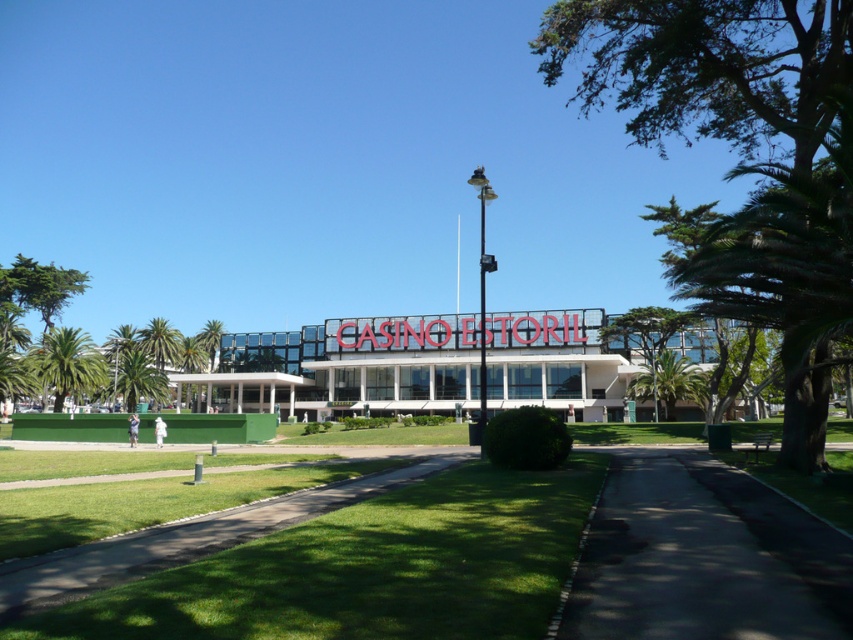
Question: Does green leafy palm tree at lower left appear on the right side of green leafy palm tree at center?

Choices:
 (A) yes
 (B) no

Answer: (A)

Question: Which object appears closest to the camera in this image?

Choices:
 (A) green leafy palm tree at center-right
 (B) green leafy palm tree at lower left
 (C) green leafy palm tree at center

Answer: (A)

Question: Which point is closer to the camera?

Choices:
 (A) green leafy palm tree at center-right
 (B) green leafy palm tree at center
 (C) green leafy palm tree at left

Answer: (A)

Question: Does green leafy palm tree at center-right appear on the right side of green leafy palm tree at center?

Choices:
 (A) yes
 (B) no

Answer: (A)

Question: Can you confirm if green leafy palm tree at left is thinner than green leafy palm tree at lower left?

Choices:
 (A) no
 (B) yes

Answer: (A)

Question: Based on their relative distances, which object is farther from the green leafy palm tree at center-right?

Choices:
 (A) green leafy palm tree at center
 (B) green leafy palm tree at lower left

Answer: (A)